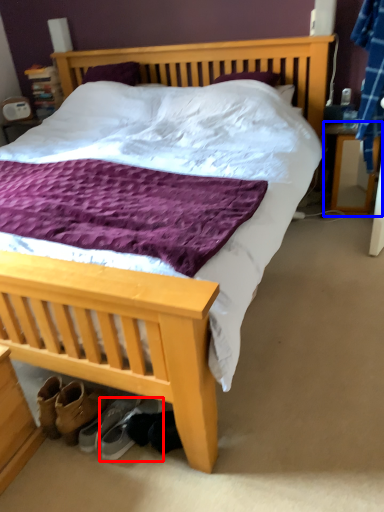
Question: Which object appears closest to the camera in this image, footwear (highlighted by a red box) or nightstand (highlighted by a blue box)?

Choices:
 (A) footwear
 (B) nightstand

Answer: (A)